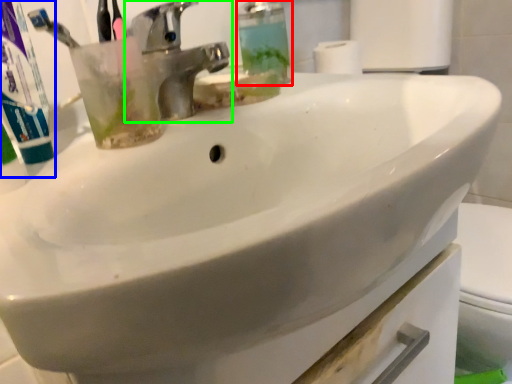
Question: Which is farther away from soap dispenser (highlighted by a red box)? toothpaste (highlighted by a blue box) or tap (highlighted by a green box)?

Choices:
 (A) toothpaste
 (B) tap

Answer: (A)